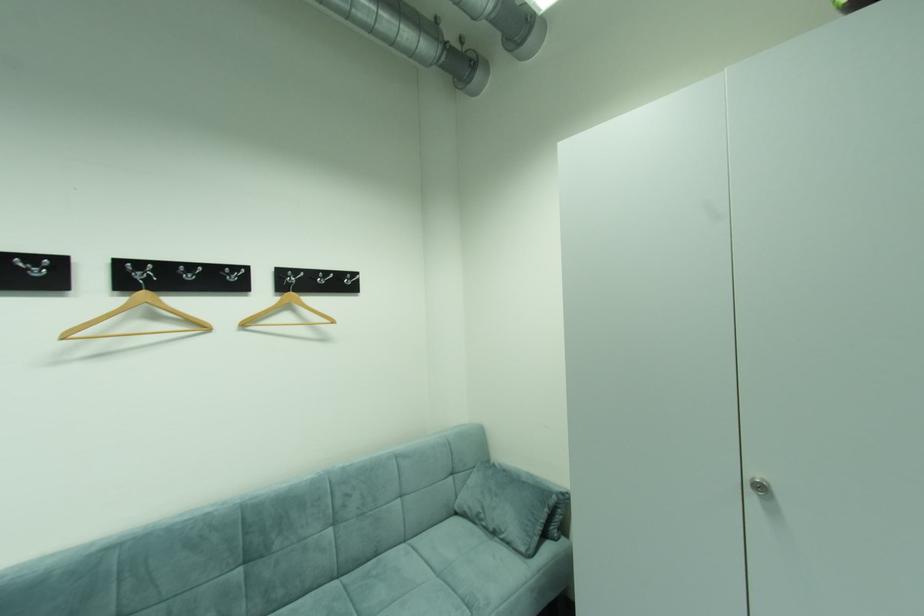
Find where to pull the silver cabinet lock. Please return your answer as a coordinate pair (x, y).

(759, 485)